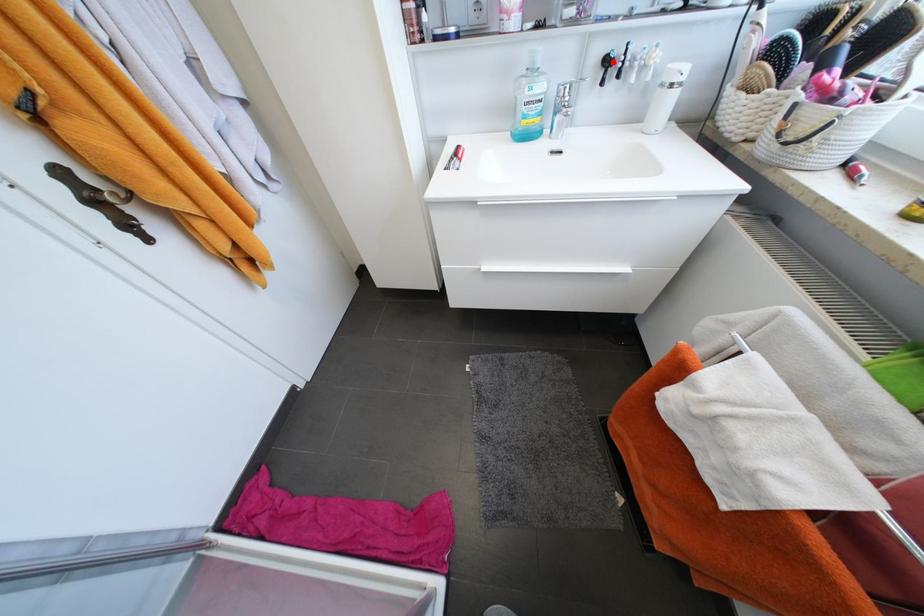
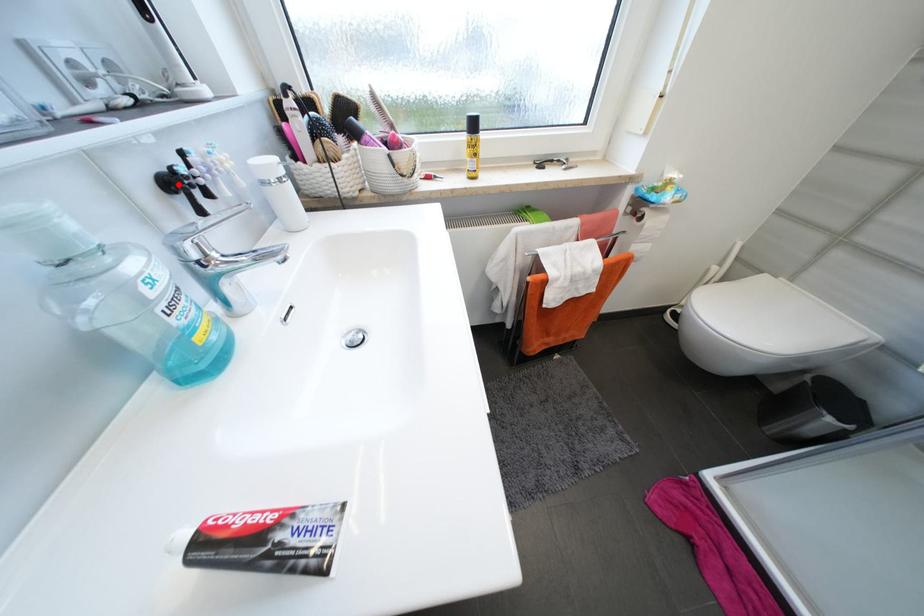
I am providing you with two images of the same scene from different viewpoints. A red point is marked on the first image and another point is marked on the second image. Are the points marked in image1 and image2 representing the same 3D position?

Yes